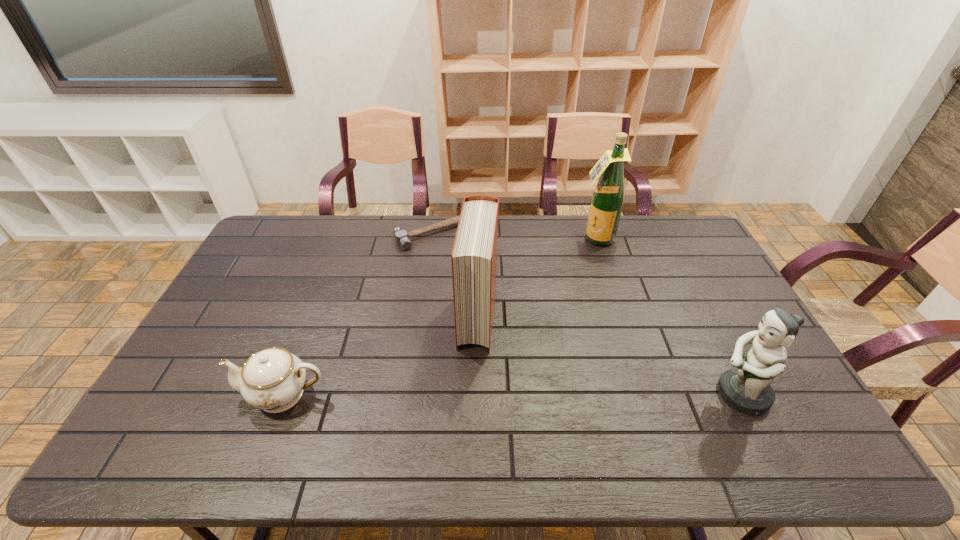
Locate an element on the screen. This screenshot has height=540, width=960. vacant spot on the desktop that is between the second shortest object and the third tallest object and is positioned on the striking face of the shortest object is located at coordinates (564, 394).

At what (x,y) coordinates should I click in order to perform the action: click on free space on the desktop that is between the leftmost object and the figurine and is positioned on the front-facing side of the fourth object from left to right. Please return your answer as a coordinate pair (x, y). The image size is (960, 540). Looking at the image, I should click on (539, 394).

This screenshot has width=960, height=540. I want to click on vacant spot on the desktop that is between the fourth tallest object and the rightmost object and is positioned on the open cover of the third nearest object, so point(467,394).